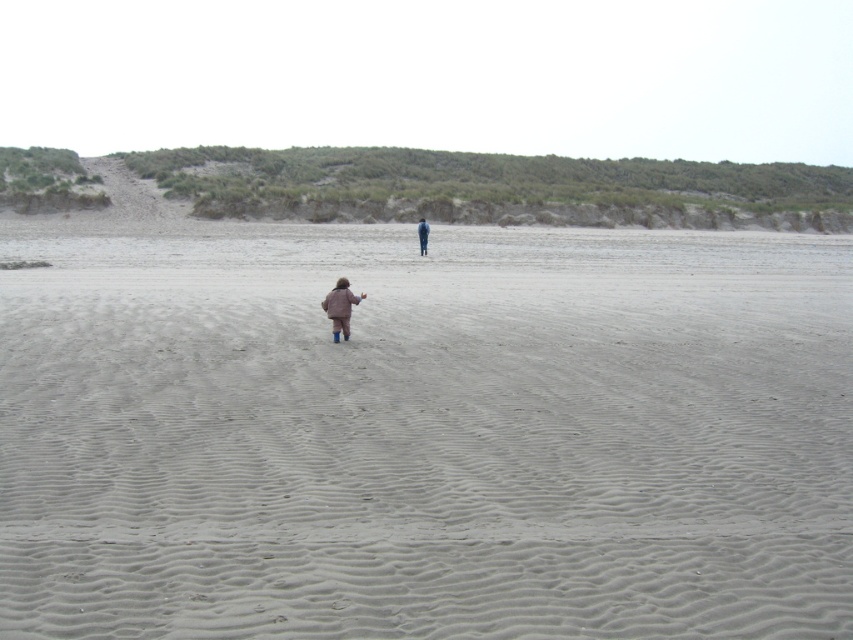
Does smooth sand at center have a smaller size compared to denim jacket at center?

Actually, smooth sand at center might be larger than denim jacket at center.

Between point (402, 600) and point (428, 227), which one is positioned in front?

Point (402, 600) is in front.

Measure the distance between point (x=637, y=332) and camera.

Point (x=637, y=332) is 49.59 feet away from camera.

Image resolution: width=853 pixels, height=640 pixels. Find the location of `smooth sand at center`. smooth sand at center is located at coordinates (425, 433).

Where is `matte brown coat at lower center`? The width and height of the screenshot is (853, 640). matte brown coat at lower center is located at coordinates (340, 307).

Is matte brown coat at lower center below denim jacket at center?

Indeed, matte brown coat at lower center is positioned under denim jacket at center.

In order to click on matte brown coat at lower center in this screenshot , I will do `click(340, 307)`.

Which is below, smooth sand at center or matte brown coat at lower center?

matte brown coat at lower center is lower down.

Locate an element on the screen. smooth sand at center is located at coordinates (425, 433).